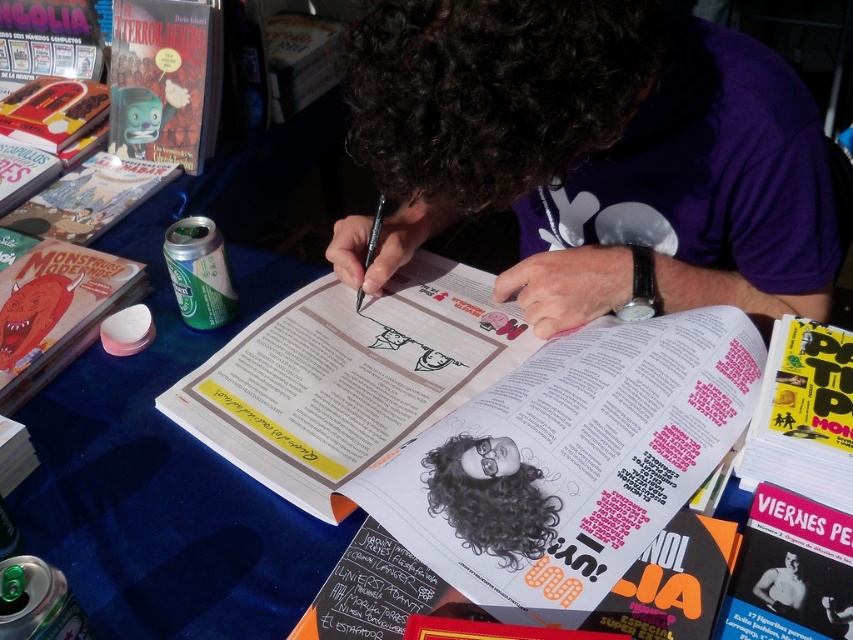
Question: Does yellow paper magazine at upper right have a lesser width compared to curly black hair at center?

Choices:
 (A) yes
 (B) no

Answer: (B)

Question: Is the position of matte paper magazine at center more distant than that of purple cotton shirt at center?

Choices:
 (A) no
 (B) yes

Answer: (B)

Question: Among these points, which one is farthest from the camera?

Choices:
 (A) (294, 417)
 (B) (96, 186)

Answer: (B)

Question: Which point is closer to the camera taking this photo?

Choices:
 (A) (83, 182)
 (B) (572, 113)

Answer: (B)

Question: Which point is closer to the camera taking this photo?

Choices:
 (A) (421, 58)
 (B) (430, 109)
 (C) (59, 188)

Answer: (A)

Question: Is purple cotton shirt at center wider than matte green can at left?

Choices:
 (A) no
 (B) yes

Answer: (B)